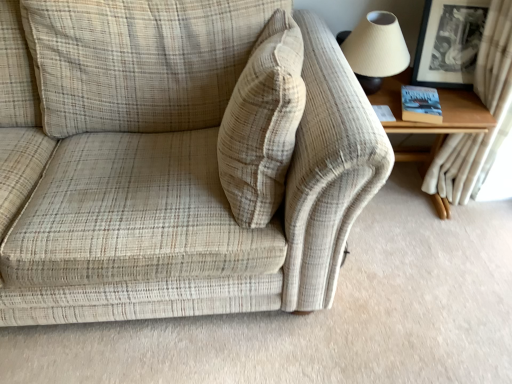
Question: Does white textured curtain at upper right have a greater height compared to matte beige lampshade at upper right?

Choices:
 (A) yes
 (B) no

Answer: (A)

Question: Considering the relative sizes of white textured curtain at upper right and matte beige lampshade at upper right in the image provided, is white textured curtain at upper right smaller than matte beige lampshade at upper right?

Choices:
 (A) yes
 (B) no

Answer: (B)

Question: Considering the relative sizes of white textured curtain at upper right and matte beige lampshade at upper right in the image provided, is white textured curtain at upper right bigger than matte beige lampshade at upper right?

Choices:
 (A) yes
 (B) no

Answer: (A)

Question: Does white textured curtain at upper right appear on the left side of matte beige lampshade at upper right?

Choices:
 (A) no
 (B) yes

Answer: (A)

Question: Is matte beige lampshade at upper right at the back of white textured curtain at upper right?

Choices:
 (A) yes
 (B) no

Answer: (B)

Question: From the image's perspective, is white textured curtain at upper right above matte beige lampshade at upper right?

Choices:
 (A) no
 (B) yes

Answer: (A)

Question: Is black glossy picture frame at upper right oriented away from wooden table at right?

Choices:
 (A) yes
 (B) no

Answer: (B)

Question: Can you confirm if black glossy picture frame at upper right is thinner than wooden table at right?

Choices:
 (A) yes
 (B) no

Answer: (A)

Question: Is black glossy picture frame at upper right shorter than wooden table at right?

Choices:
 (A) no
 (B) yes

Answer: (B)

Question: From the image's perspective, is black glossy picture frame at upper right beneath wooden table at right?

Choices:
 (A) yes
 (B) no

Answer: (B)

Question: Is black glossy picture frame at upper right wider than wooden table at right?

Choices:
 (A) no
 (B) yes

Answer: (A)

Question: Could you tell me if black glossy picture frame at upper right is facing wooden table at right?

Choices:
 (A) no
 (B) yes

Answer: (A)

Question: From a real-world perspective, is wooden table at right positioned over beige plaid fabric couch at center based on gravity?

Choices:
 (A) no
 (B) yes

Answer: (A)